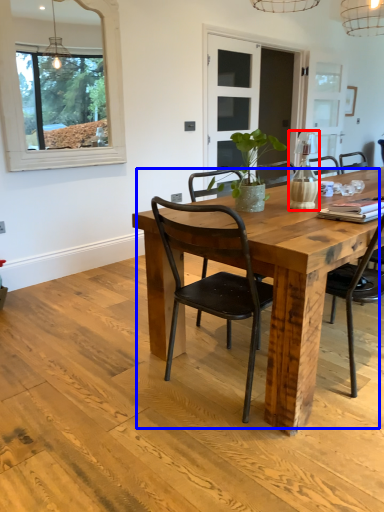
Question: Which point is further to the camera, vase (highlighted by a red box) or kitchen & dining room table (highlighted by a blue box)?

Choices:
 (A) vase
 (B) kitchen & dining room table

Answer: (A)